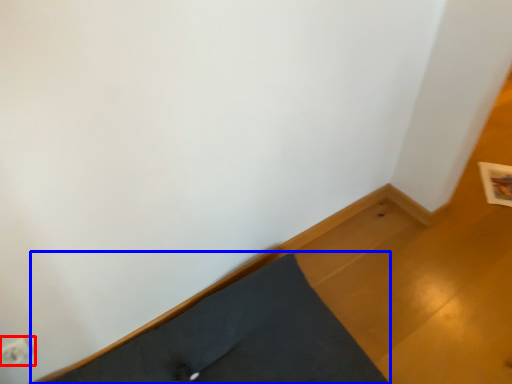
Question: Which of the following is the farthest to the observer, electric outlet (highlighted by a red box) or bed frame (highlighted by a blue box)?

Choices:
 (A) electric outlet
 (B) bed frame

Answer: (A)